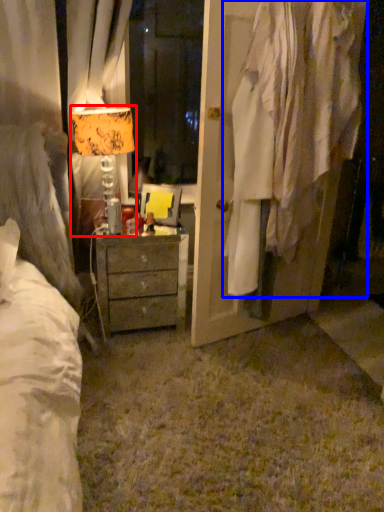
Question: Which object appears farthest to the camera in this image, table lamp (highlighted by a red box) or clothing (highlighted by a blue box)?

Choices:
 (A) table lamp
 (B) clothing

Answer: (A)